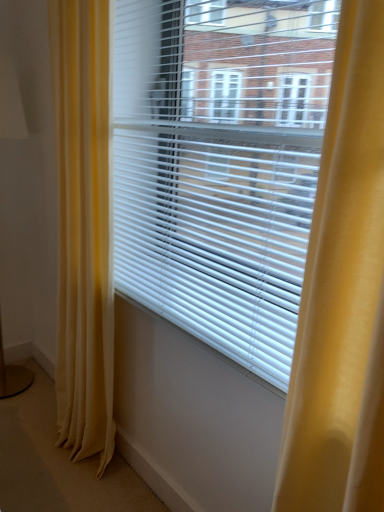
Question: Which is correct: white plastic blinds at center is inside matte gold table lamp at left, or outside of it?

Choices:
 (A) inside
 (B) outside

Answer: (B)

Question: In terms of height, does white plastic blinds at center look taller or shorter compared to matte gold table lamp at left?

Choices:
 (A) tall
 (B) short

Answer: (B)

Question: Estimate the real-world distances between objects in this image. Which object is farther from the white plastic blinds at center?

Choices:
 (A) silky yellow curtain at left
 (B) matte gold table lamp at left

Answer: (B)

Question: Which of these objects is positioned farthest from the white plastic blinds at center?

Choices:
 (A) silky yellow curtain at left
 (B) matte gold table lamp at left

Answer: (B)